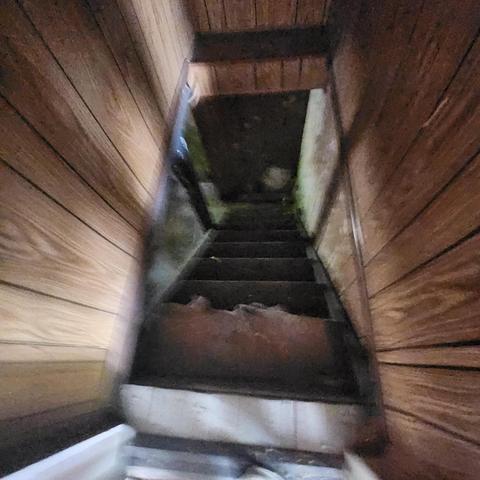
The image size is (480, 480). Identify the location of wall. (418, 165).